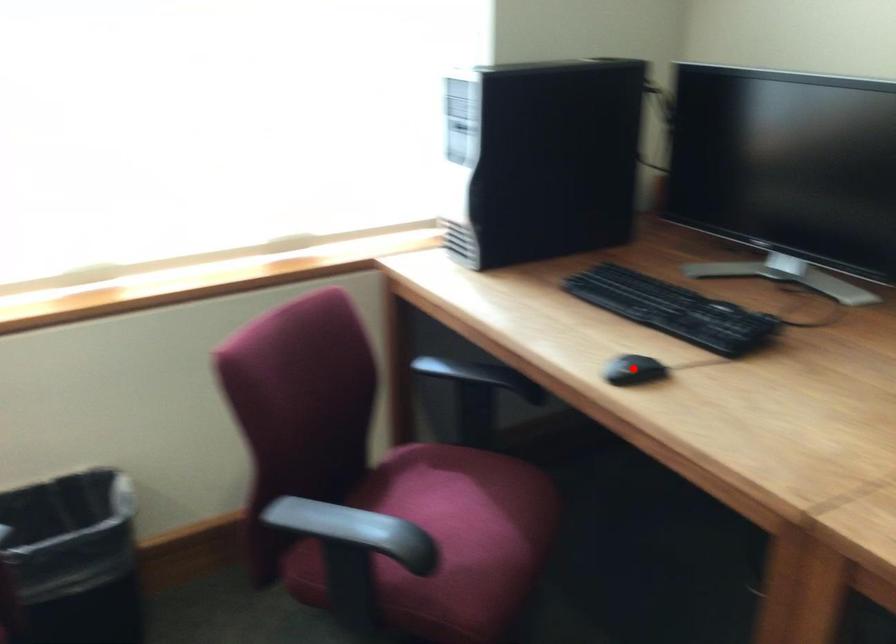
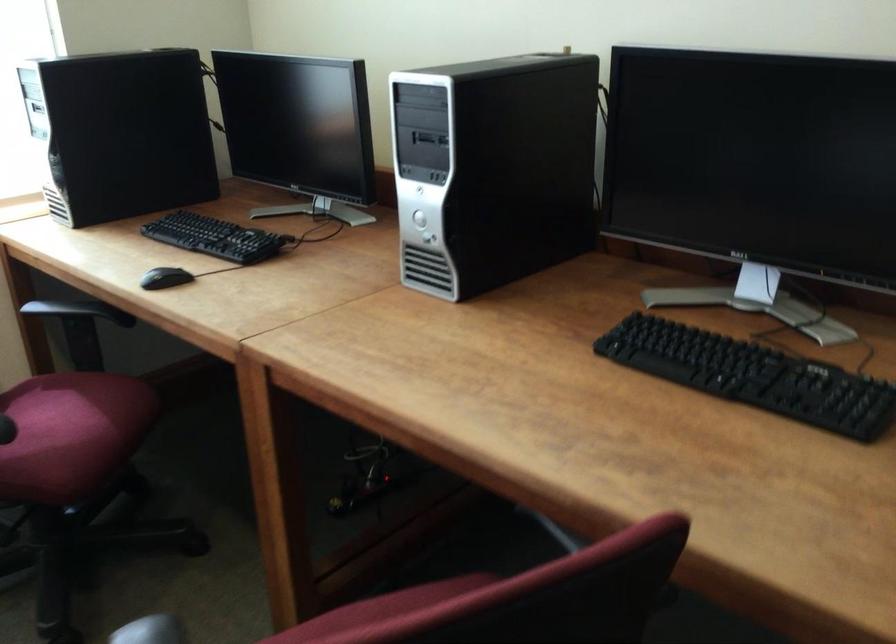
In the second image, find the point that corresponds to the highlighted location in the first image.

(165, 278)